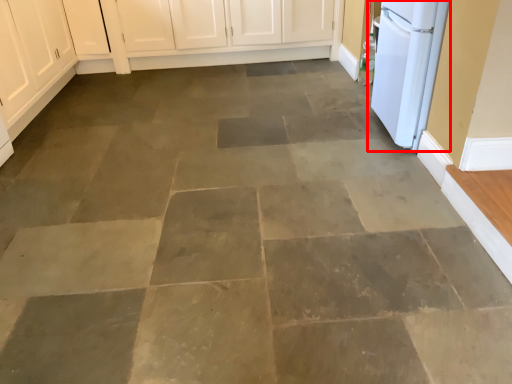
Question: Observing the image, what is the correct spatial positioning of home appliance (annotated by the red box) in reference to cabinetry?

Choices:
 (A) left
 (B) right

Answer: (B)